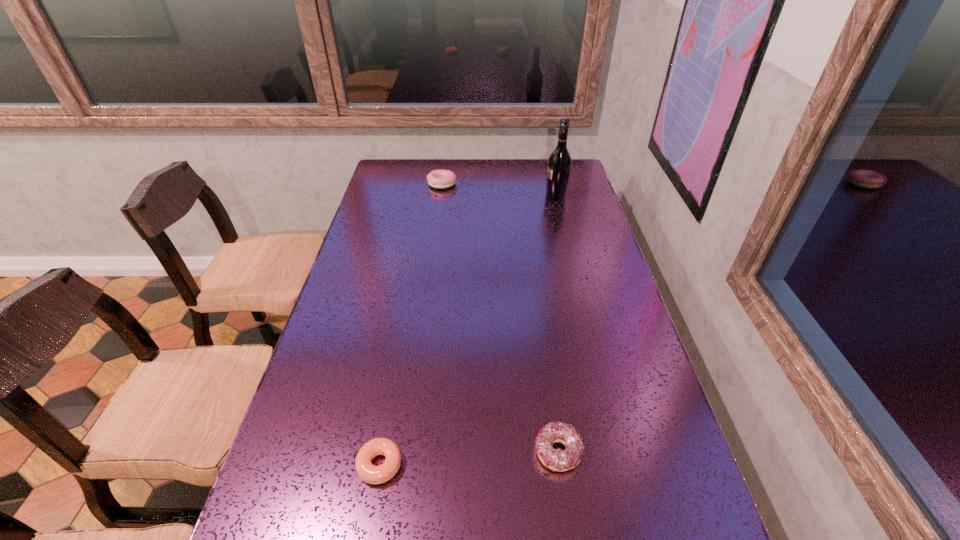
Locate an element on the screen. Image resolution: width=960 pixels, height=540 pixels. wine bottle is located at coordinates click(559, 162).

Image resolution: width=960 pixels, height=540 pixels. Find the location of `the rightmost object`. the rightmost object is located at coordinates tap(559, 162).

Where is `the farthest object`? the farthest object is located at coordinates 440,179.

At what (x,y) coordinates should I click in order to perform the action: click on the third object from left to right. Please return your answer as a coordinate pair (x, y). Looking at the image, I should click on (560, 460).

This screenshot has width=960, height=540. I want to click on the shortest doughnut, so click(371, 474).

This screenshot has width=960, height=540. Find the location of `vacant space located 0.100m on the label of the tallest object`. vacant space located 0.100m on the label of the tallest object is located at coordinates (518, 197).

Image resolution: width=960 pixels, height=540 pixels. Find the location of `vacant space located on the label of the tallest object`. vacant space located on the label of the tallest object is located at coordinates (503, 197).

Where is `vacant position located on the label of the tallest object`? vacant position located on the label of the tallest object is located at coordinates (474, 197).

The height and width of the screenshot is (540, 960). What are the coordinates of `free space located 0.160m on the back of the farthest doughnut` in the screenshot? It's located at (445, 159).

I want to click on vacant space located 0.200m on the left of the rightmost doughnut, so click(x=439, y=452).